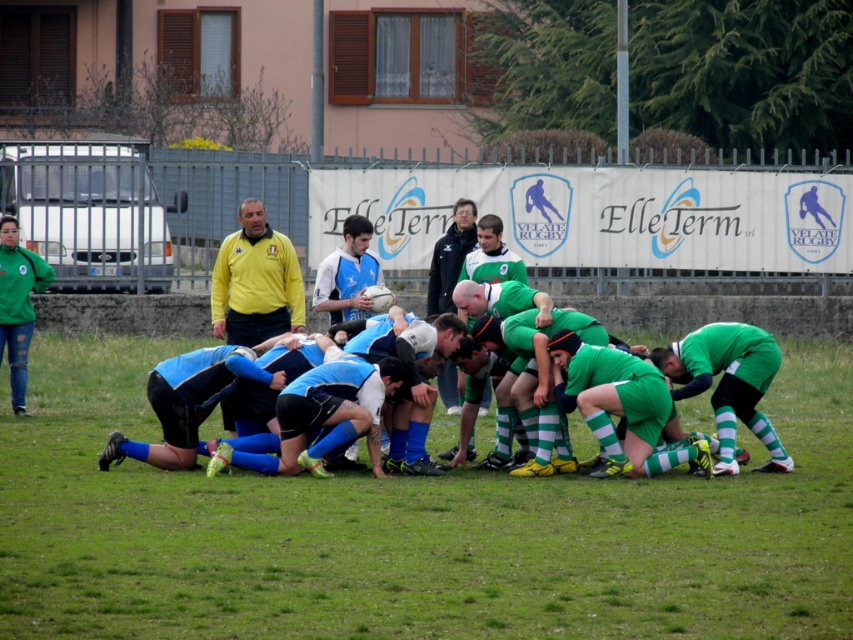
From the picture: Between blue fabric rugby players at center and jeans at left, which one appears on the right side from the viewer's perspective?

From the viewer's perspective, blue fabric rugby players at center appears more on the right side.

Who is taller, blue fabric rugby players at center or jeans at left?

jeans at left is taller.

This screenshot has width=853, height=640. Find the location of `blue fabric rugby players at center`. blue fabric rugby players at center is located at coordinates (410, 531).

Locate an element on the screen. Image resolution: width=853 pixels, height=640 pixels. blue fabric rugby players at center is located at coordinates (410, 531).

Who is positioned more to the left, yellow jersey at center or dark blue jersey at center?

From the viewer's perspective, yellow jersey at center appears more on the left side.

Is yellow jersey at center wider than dark blue jersey at center?

Indeed, yellow jersey at center has a greater width compared to dark blue jersey at center.

Is point (225, 316) in front of point (466, 234)?

Yes, point (225, 316) is in front of point (466, 234).

The width and height of the screenshot is (853, 640). I want to click on yellow jersey at center, so click(254, 282).

Can you confirm if blue fabric rugby players at center is bigger than dark blue jersey at center?

Yes.

Is blue fabric rugby players at center to the left of dark blue jersey at center from the viewer's perspective?

In fact, blue fabric rugby players at center is to the right of dark blue jersey at center.

Is point (782, 371) positioned after point (461, 218)?

Yes, it is.

I want to click on blue fabric rugby players at center, so (410, 531).